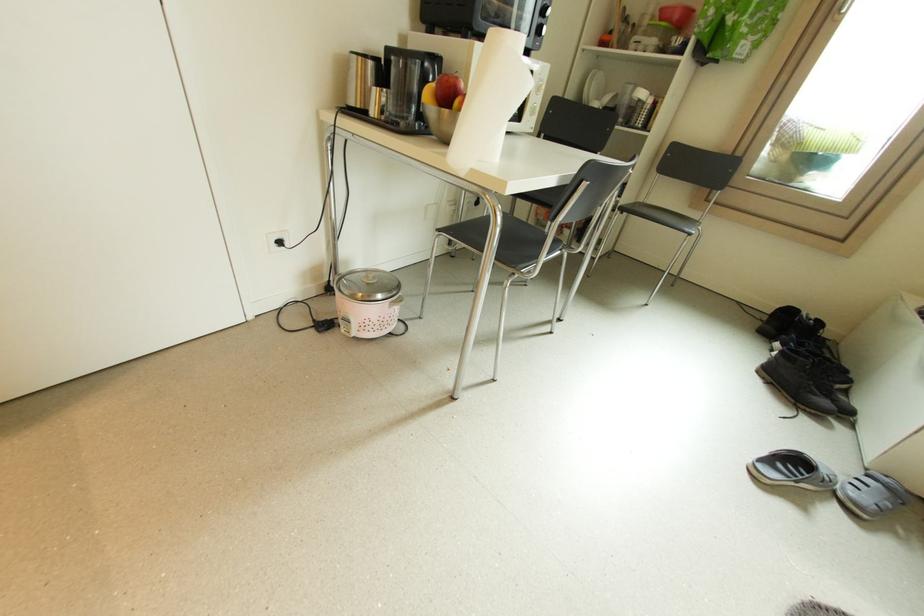
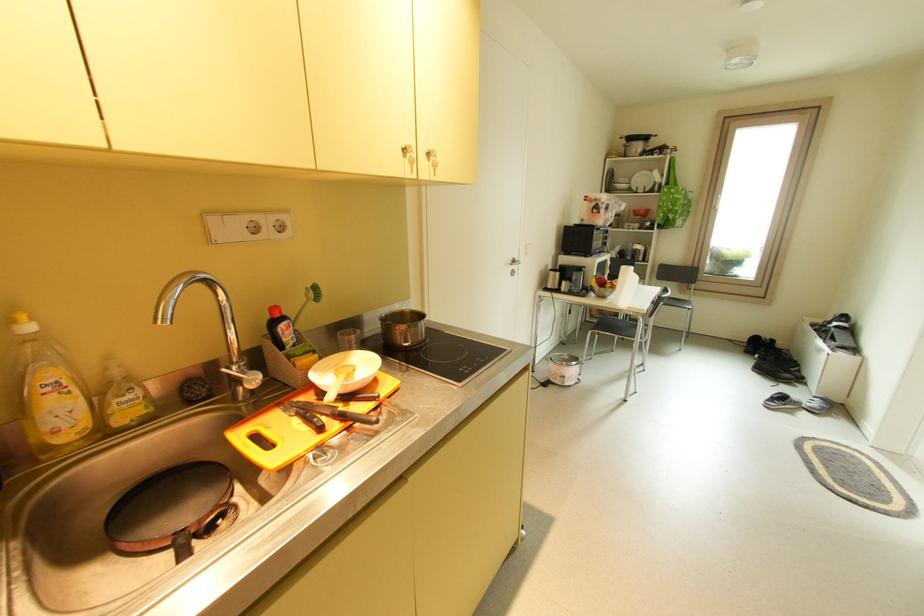
What movement of the cameraman would produce the second image?

The cameraman moved toward left, backward.